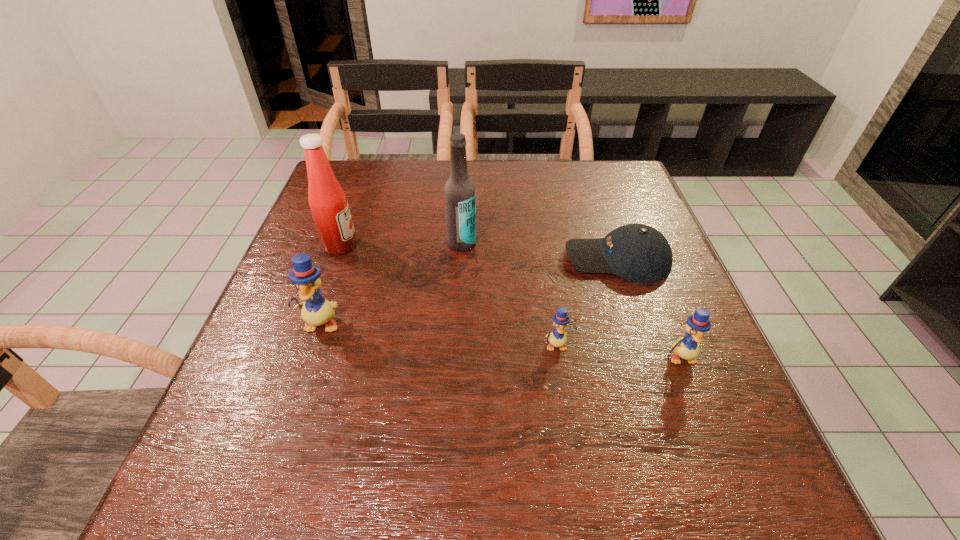
Image resolution: width=960 pixels, height=540 pixels. Identify the location of the third nearest object. (316, 310).

The image size is (960, 540). Identify the location of the leftmost duckling. (316, 310).

You are a GUI agent. You are given a task and a screenshot of the screen. Output one action in this format:
    pyautogui.click(x=<x>, y=<y>)
    Task: Click on the second duckling from right to left
    This screenshot has height=540, width=960.
    Given the screenshot: What is the action you would take?
    pyautogui.click(x=557, y=338)

The height and width of the screenshot is (540, 960). I want to click on the shortest duckling, so click(x=557, y=338).

Locate an element on the screen. The width and height of the screenshot is (960, 540). the rightmost duckling is located at coordinates (687, 347).

You are a GUI agent. You are given a task and a screenshot of the screen. Output one action in this format:
    pyautogui.click(x=<x>, y=<y>)
    Task: Click on the second tallest duckling
    The image size is (960, 540).
    Given the screenshot: What is the action you would take?
    pyautogui.click(x=687, y=347)

Locate an element on the screen. This screenshot has height=540, width=960. condiment is located at coordinates (328, 203).

The width and height of the screenshot is (960, 540). I want to click on baseball cap, so click(638, 253).

At what (x,y) coordinates should I click in order to perform the action: click on the fourth object from right to left. Please return your answer as a coordinate pair (x, y). Image resolution: width=960 pixels, height=540 pixels. Looking at the image, I should click on (459, 192).

Find the location of a particular element. vacant space located 0.180m on the face of the farthest duckling, where the monocle is placed is located at coordinates click(x=288, y=421).